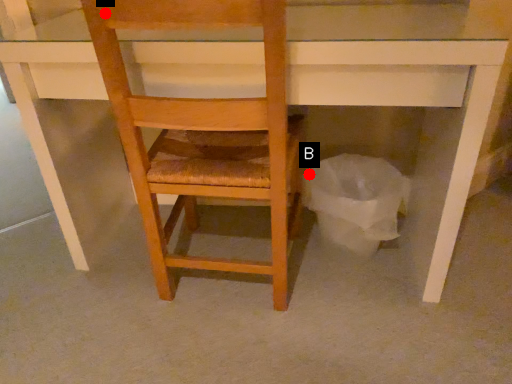
Question: Two points are circled on the image, labeled by A and B beside each circle. Which point appears closest to the camera in this image?

Choices:
 (A) A is closer
 (B) B is closer

Answer: (A)